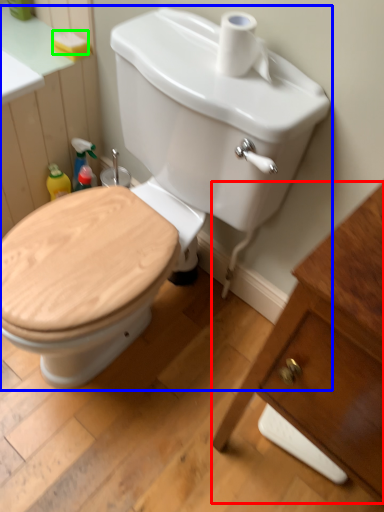
Question: Based on their relative distances, which object is farther from porcelain (highlighted by a red box)? Choose from toilet (highlighted by a blue box) and soap (highlighted by a green box).

Choices:
 (A) toilet
 (B) soap

Answer: (B)